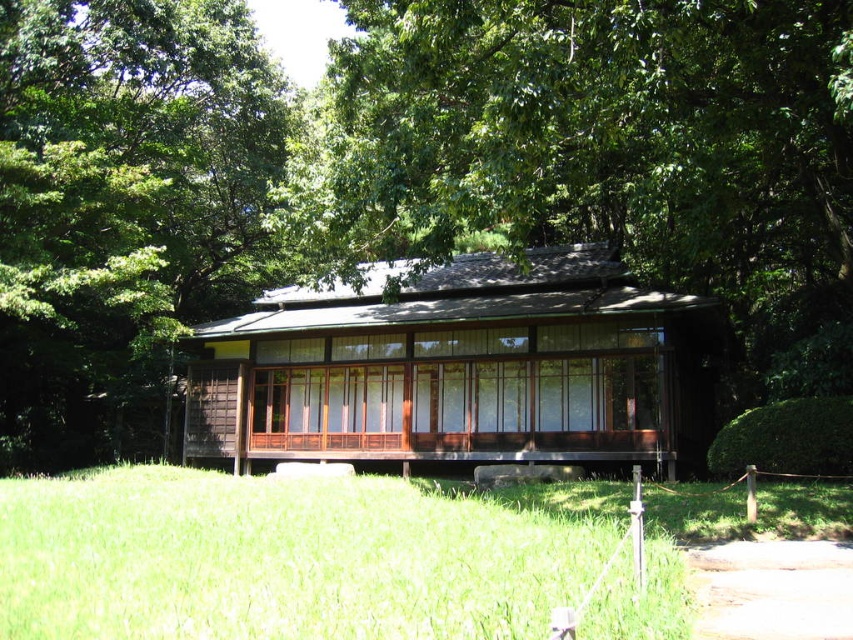
Between green leafy tree at center and brown wooden cabin at center, which one appears on the right side from the viewer's perspective?

brown wooden cabin at center

Is point (99, 380) closer to camera compared to point (267, 406)?

No, (99, 380) is behind (267, 406).

At what (x,y) coordinates should I click in order to perform the action: click on green leafy tree at center. Please return your answer as a coordinate pair (x, y). Looking at the image, I should click on (410, 170).

Image resolution: width=853 pixels, height=640 pixels. I want to click on green leafy tree at center, so click(x=410, y=170).

Who is more forward, (6, 572) or (432, 308)?

Point (6, 572)

Find the location of a particular element. This screenshot has height=640, width=853. green grass at center is located at coordinates (282, 557).

Can you confirm if green leafy tree at center is positioned to the right of green grass at center?

Indeed, green leafy tree at center is positioned on the right side of green grass at center.

Which is more to the left, green leafy tree at center or green grass at center?

From the viewer's perspective, green grass at center appears more on the left side.

Between point (845, 10) and point (358, 577), which one is positioned in front?

Positioned in front is point (358, 577).

Identify the location of green leafy tree at center. (410, 170).